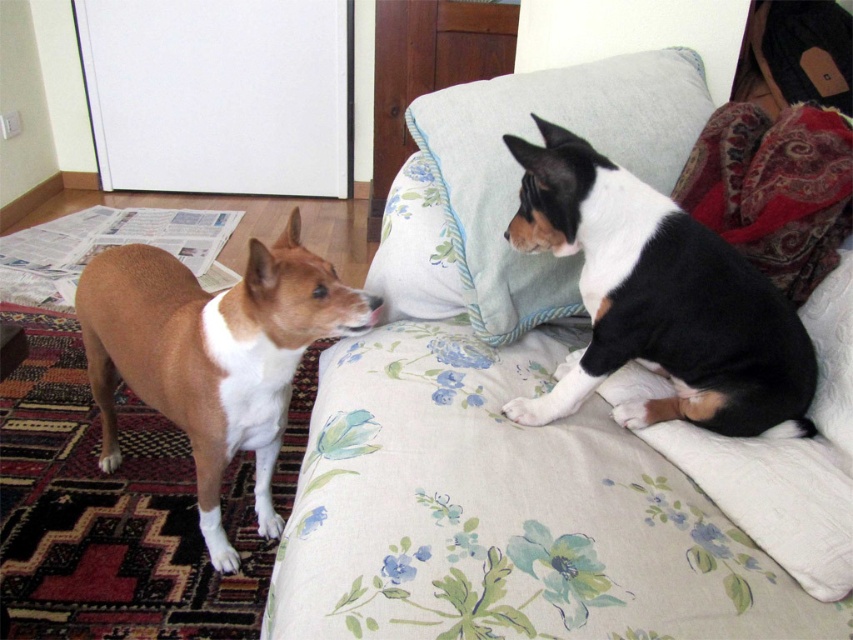
Between black and white fur at upper right and brown matte dog at left, which one appears on the left side from the viewer's perspective?

brown matte dog at left

What do you see at coordinates (659, 300) in the screenshot? The height and width of the screenshot is (640, 853). I see `black and white fur at upper right` at bounding box center [659, 300].

Between point (543, 125) and point (175, 292), which one is positioned in front?

Point (543, 125) is more forward.

Where is `black and white fur at upper right`? The width and height of the screenshot is (853, 640). black and white fur at upper right is located at coordinates (659, 300).

Describe the element at coordinates (521, 426) in the screenshot. I see `floral fabric couch at upper center` at that location.

Who is more forward, (531,492) or (466,138)?

Point (531,492) is in front.

At what (x,y) coordinates should I click in order to perform the action: click on floral fabric couch at upper center. Please return your answer as a coordinate pair (x, y). The height and width of the screenshot is (640, 853). Looking at the image, I should click on (521, 426).

From the picture: Can you confirm if floral fabric couch at upper center is wider than black and white fur at upper right?

Yes.

What do you see at coordinates (521, 426) in the screenshot?
I see `floral fabric couch at upper center` at bounding box center [521, 426].

You are a GUI agent. You are given a task and a screenshot of the screen. Output one action in this format:
    pyautogui.click(x=<x>, y=<y>)
    Task: Click on the floral fabric couch at upper center
    
    Given the screenshot: What is the action you would take?
    pyautogui.click(x=521, y=426)